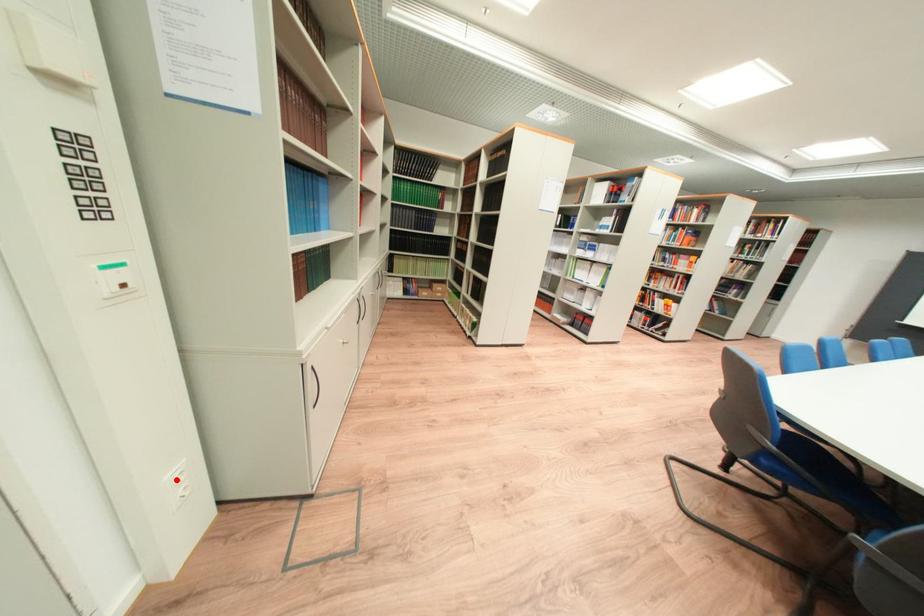
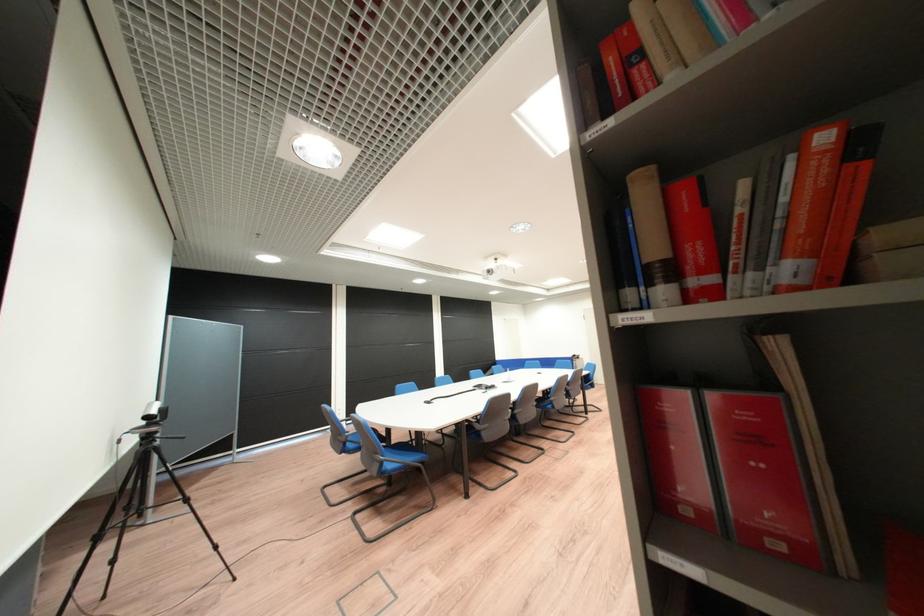
Question: I am providing you with two images of the same scene from different viewpoints. A red point is marked on the first image. At the location where the point appears in image 1, is it still visible in image 2?

Choices:
 (A) Yes
 (B) No

Answer: (B)